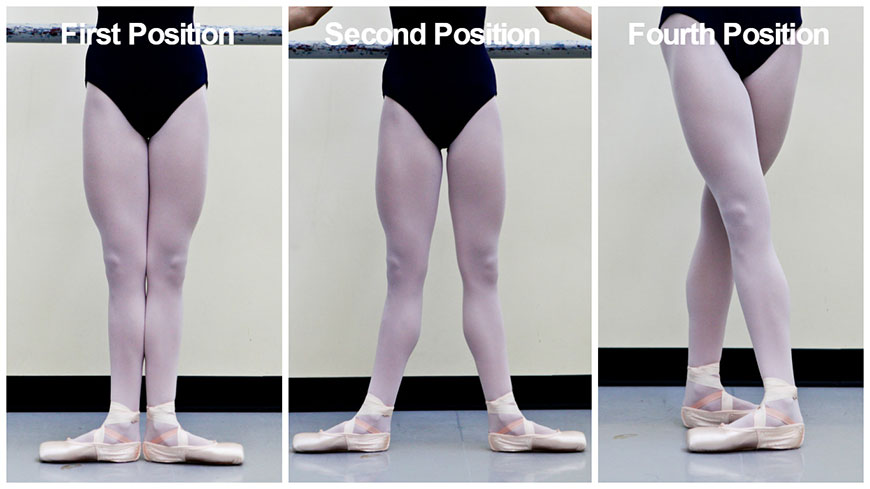
This screenshot has height=489, width=870. I want to click on tiled floor, so click(431, 428), click(482, 466), click(644, 412), click(844, 407), click(262, 418), click(27, 418).